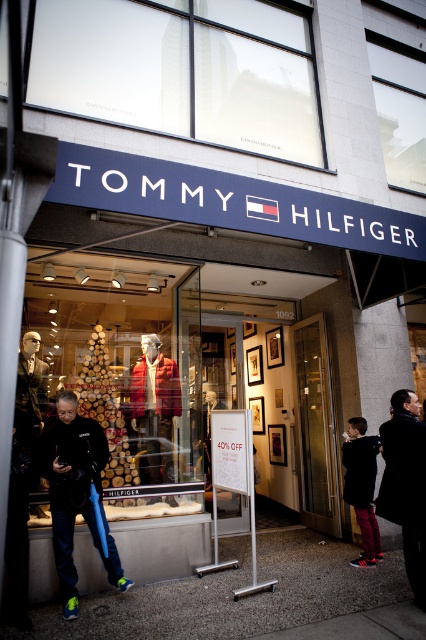
In the scene shown: You are a customer standing outside the Tommy Hilfiger store at 1092. You see the black matte jacket at lower left and the glass door at center. Which item is nearer to you?

The black matte jacket at lower left is closer to the viewer than the glass door at center.

You are a delivery person trying to deliver a package to the Tommy Hilfiger store at 1092. You see the transparent glass at upper center and the dark gray coat at lower right. Which object is larger in size?

The transparent glass at upper center is bigger than the dark gray coat at lower right according to the description.

You are a customer standing outside the Tommy Hilfiger store. You want to enter the store through the glass door at center. Is the black matte jacket at lower left blocking your path to the door?

The black matte jacket at lower left is located below the glass door at center, so it is positioned lower and not directly in front of the door. Therefore, the black matte jacket at lower left is not blocking your path to the glass door at center.